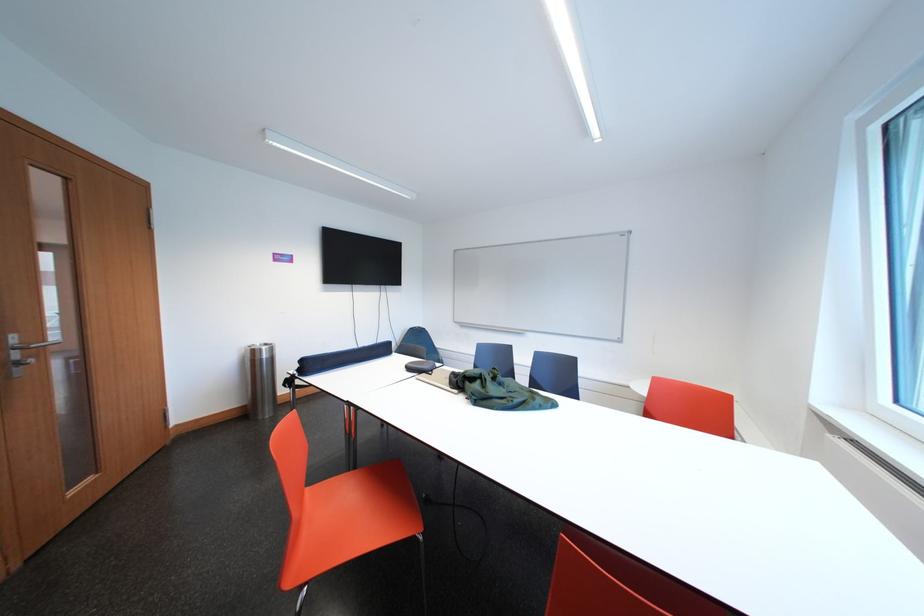
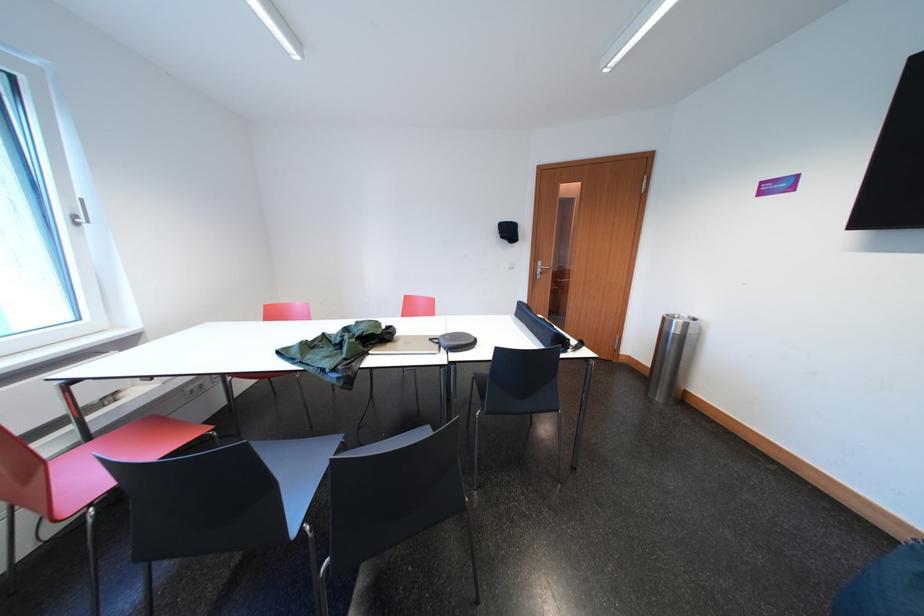
Where in the second image is the point corresponding to [263,357] from the first image?

(672, 323)